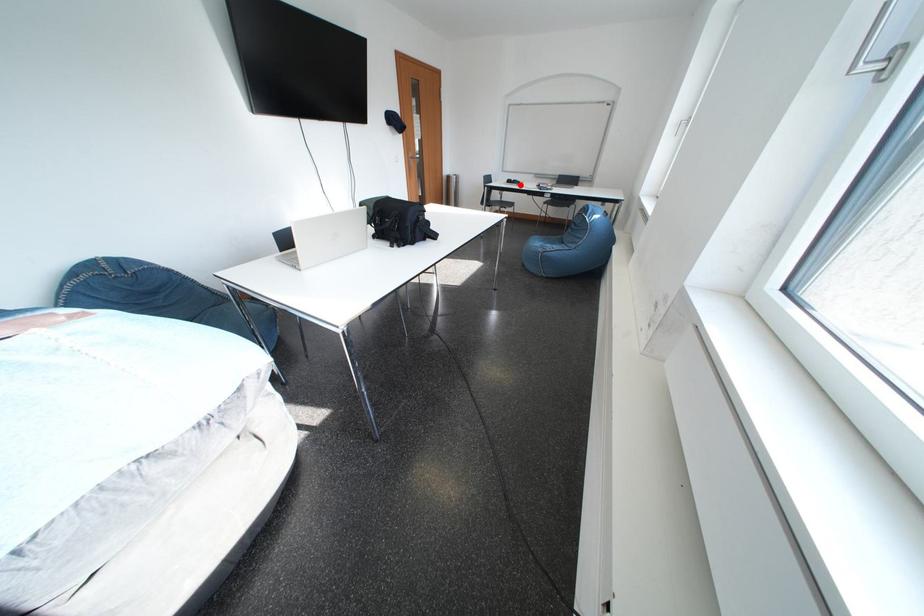
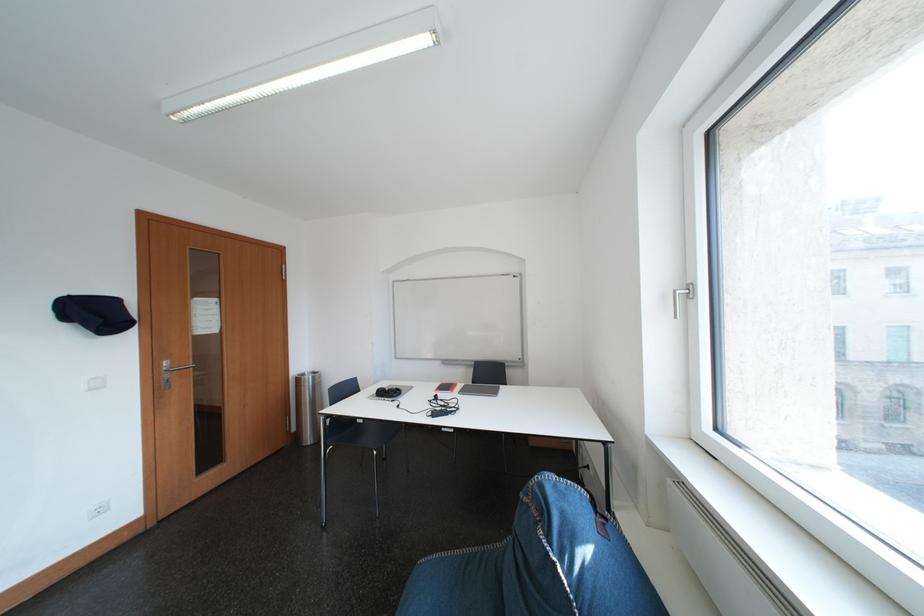
In the second image, find the point that corresponds to the highlighted location in the first image.

(393, 395)